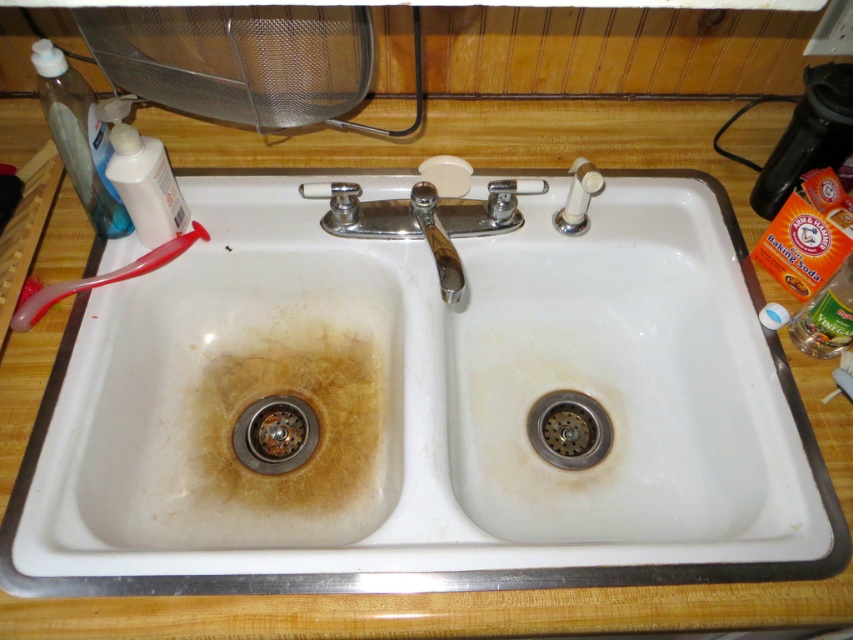
Question: Estimate the real-world distances between objects in this image. Which object is closer to the polished chrome faucet at center?

Choices:
 (A) transparent plastic bottle at upper left
 (B) rusty metal drain at lower left
 (C) white matte soap at upper center
 (D) white ceramic sink at center

Answer: (C)

Question: Does stainless steel drain at center appear over clear glass bottle at right?

Choices:
 (A) no
 (B) yes

Answer: (A)

Question: Can you confirm if white ceramic sink at center is positioned above rusty metal drain at lower left?

Choices:
 (A) no
 (B) yes

Answer: (B)

Question: Which object appears closest to the camera in this image?

Choices:
 (A) white ceramic sink at center
 (B) rusty metal drain at lower left

Answer: (A)

Question: Can you confirm if transparent plastic bottle at upper left is positioned below rusty metal drain at lower left?

Choices:
 (A) yes
 (B) no

Answer: (B)

Question: Which point is closer to the camera?

Choices:
 (A) polished chrome faucet at center
 (B) stainless steel drain at center

Answer: (A)